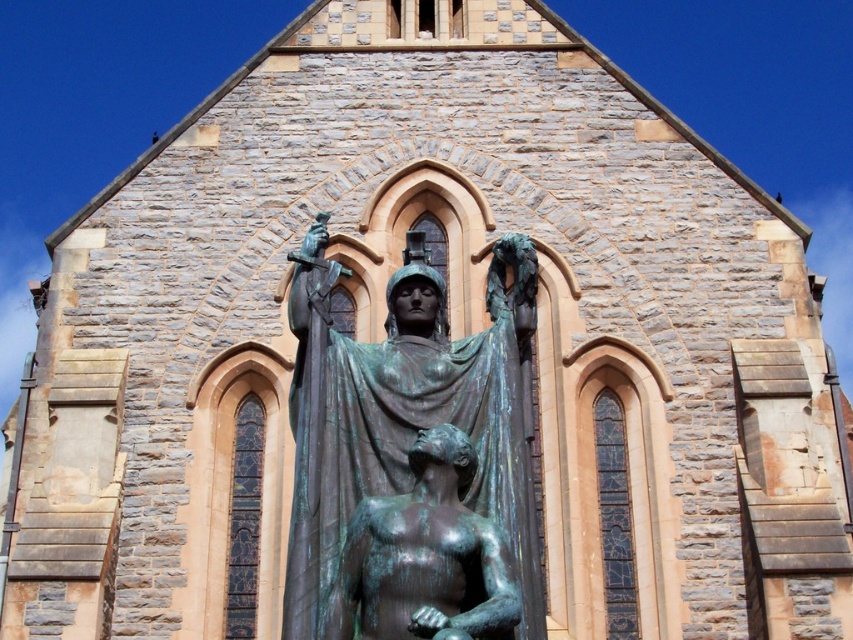
Question: Is bronze statue at center below green patina statue at center?

Choices:
 (A) yes
 (B) no

Answer: (B)

Question: Which of the following is the farthest from the observer?

Choices:
 (A) bronze statue at center
 (B) green patina statue at center

Answer: (A)

Question: Does bronze statue at center appear over green patina statue at center?

Choices:
 (A) no
 (B) yes

Answer: (B)

Question: Does bronze statue at center have a larger size compared to green patina statue at center?

Choices:
 (A) yes
 (B) no

Answer: (A)

Question: Which object is farther from the camera taking this photo?

Choices:
 (A) green patina statue at center
 (B) bronze statue at center

Answer: (B)

Question: Which point is closer to the camera?

Choices:
 (A) (531, 321)
 (B) (457, 584)

Answer: (B)